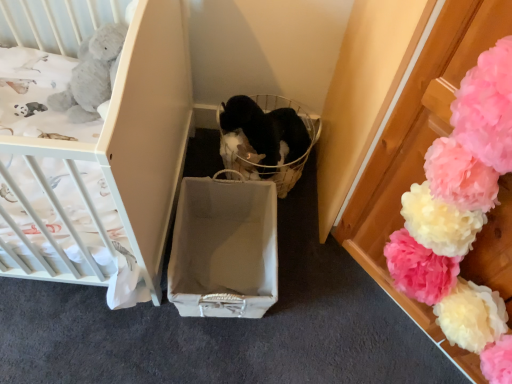
Locate an element on the screen. vacant region under fluffy tissue paper pom-poms at right (from a real-world perspective) is located at coordinates (371, 324).